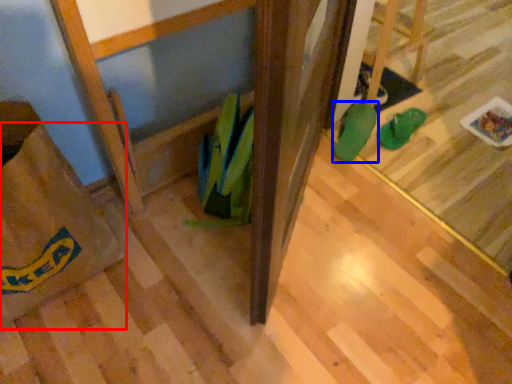
Question: Which object appears closest to the camera in this image, grocery bag (highlighted by a red box) or footwear (highlighted by a blue box)?

Choices:
 (A) grocery bag
 (B) footwear

Answer: (A)